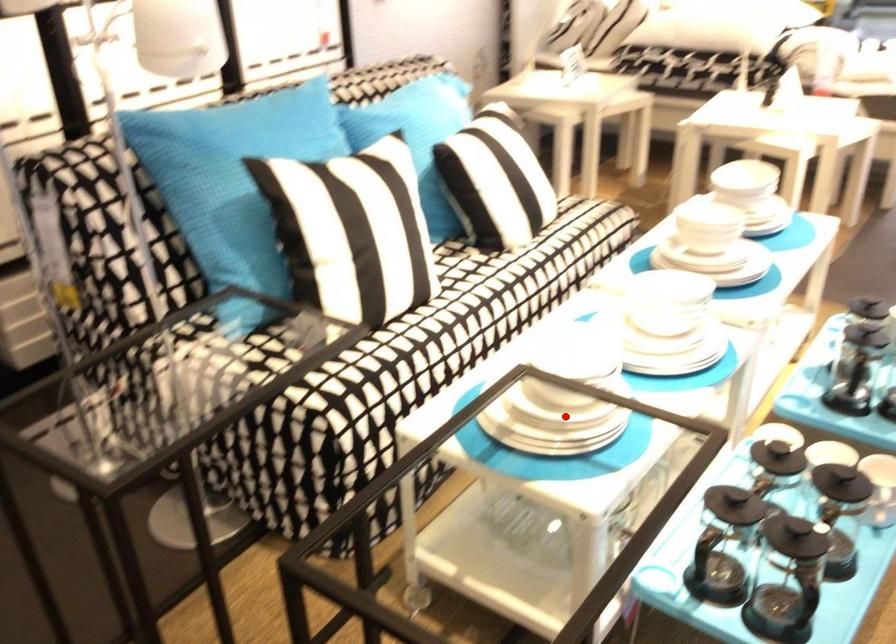
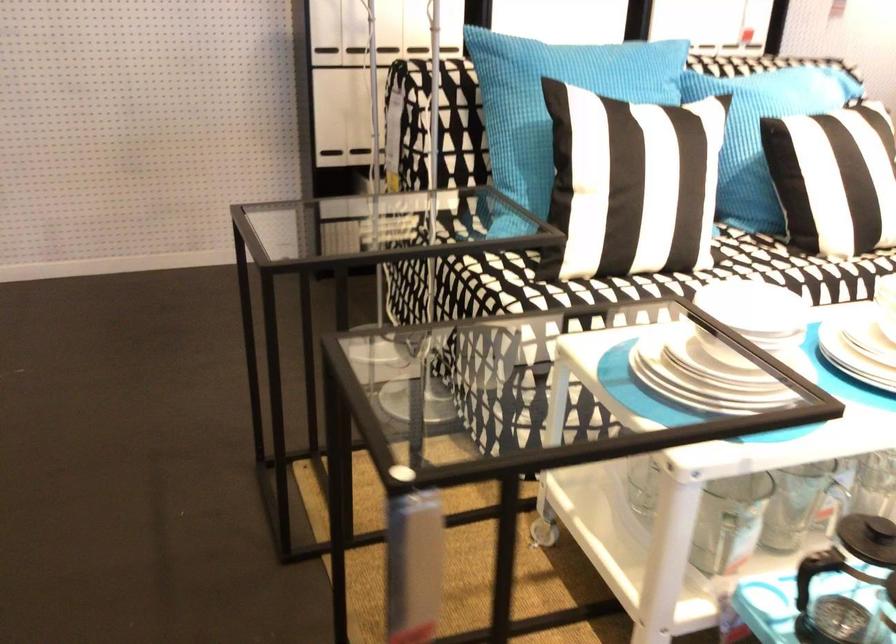
Question: I am providing you with two images of the same scene from different viewpoints. In image1, a red point is highlighted. Considering the same 3D point in image2, which of the following is correct?

Choices:
 (A) It is closer
 (B) It is farther

Answer: (A)